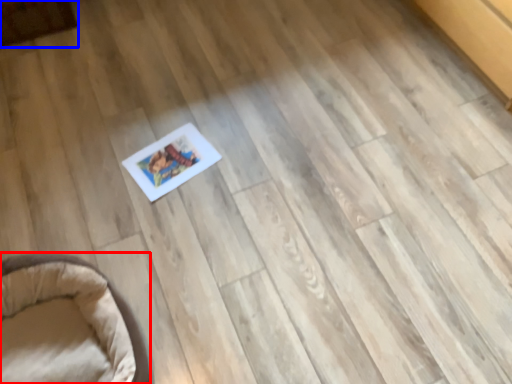
Question: Which point is closer to the camera, furniture (highlighted by a red box) or furniture (highlighted by a blue box)?

Choices:
 (A) furniture
 (B) furniture

Answer: (A)